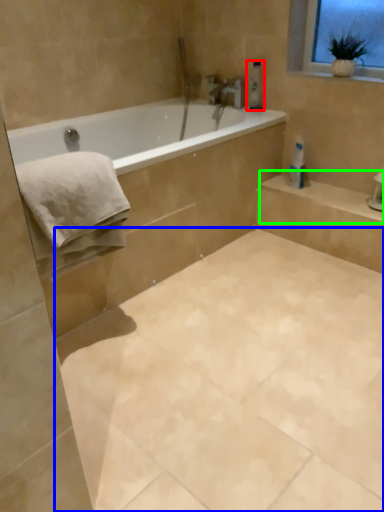
Question: Which object is positioned closest to toiletry (highlighted by a red box)? Select from ceramic tile (highlighted by a blue box) and balustrade (highlighted by a green box).

Choices:
 (A) ceramic tile
 (B) balustrade

Answer: (B)